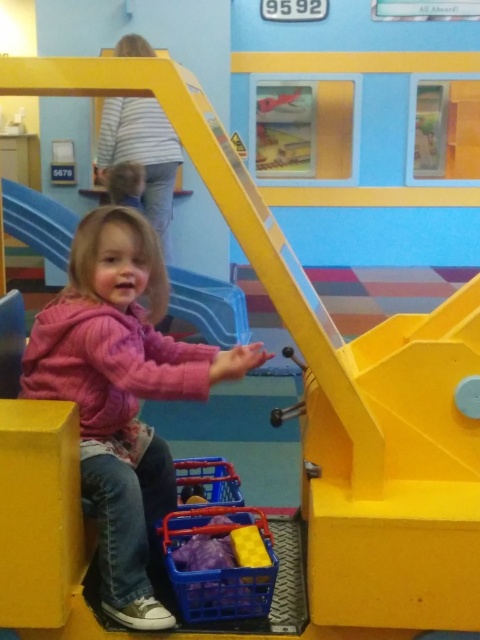
Question: Which of the following is the closest to the observer?

Choices:
 (A) pink fleece jacket at lower left
 (B) blonde hair at upper center
 (C) yellow plastic slide at center

Answer: (A)

Question: Is blue plastic crate at lower center further to camera compared to blonde hair at upper center?

Choices:
 (A) yes
 (B) no

Answer: (B)

Question: Which of these objects is positioned closest to the blue plastic crate at lower center?

Choices:
 (A) pink fleece jacket at lower left
 (B) blonde hair at upper center
 (C) yellow plastic slide at center

Answer: (A)

Question: Does pink fleece jacket at lower left come behind yellow plastic slide at center?

Choices:
 (A) no
 (B) yes

Answer: (A)

Question: Which object appears farthest from the camera in this image?

Choices:
 (A) yellow plastic slide at center
 (B) blonde hair at upper center
 (C) pink fleece jacket at lower left

Answer: (A)

Question: Is blue plastic crate at lower center wider than blonde hair at upper center?

Choices:
 (A) yes
 (B) no

Answer: (B)